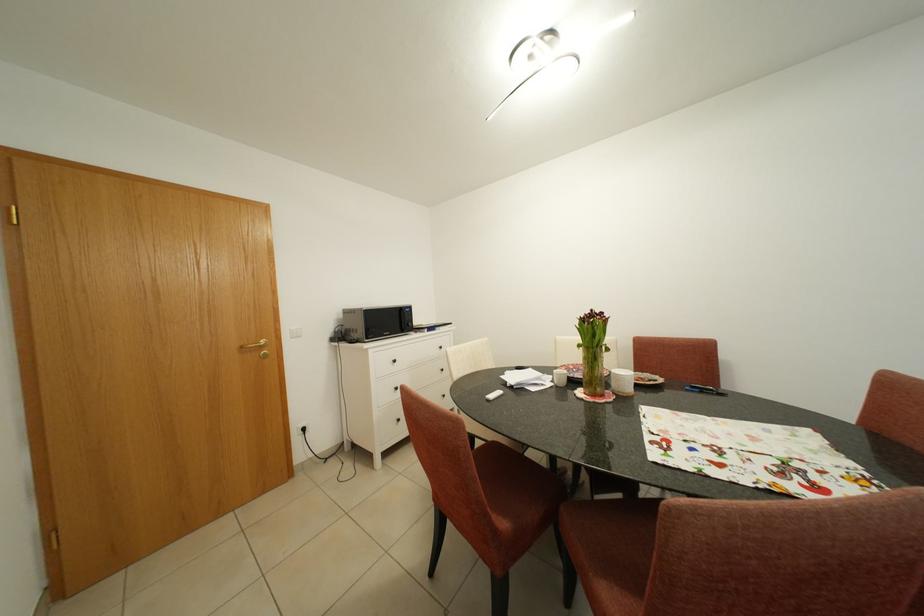
Find where to sit the white chair sitting surface. Please return your answer as a coordinate pair (x, y).

(517, 487)